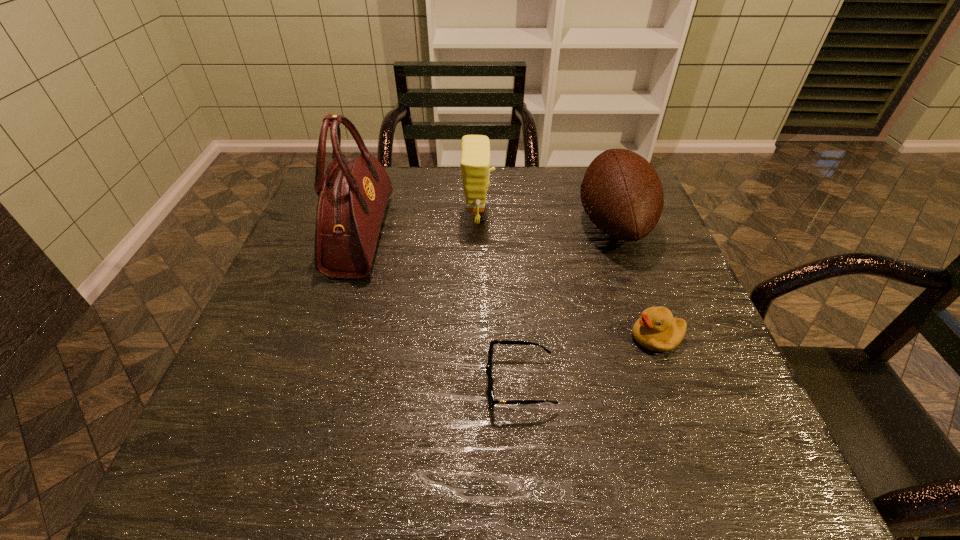
You are a GUI agent. You are given a task and a screenshot of the screen. Output one action in this format:
    pyautogui.click(x=<x>, y=<y>)
    Task: Click on the vacant region located 0.290m on the laces of the football
    The height and width of the screenshot is (540, 960).
    Given the screenshot: What is the action you would take?
    pyautogui.click(x=469, y=224)

What are the coordinates of `vacant space located at the beak of the fourth tallest object` in the screenshot? It's located at (582, 338).

Locate an element on the screen. This screenshot has height=540, width=960. free region located 0.390m at the beak of the fourth tallest object is located at coordinates (441, 338).

Identify the location of vacant region located at the beak of the fourth tallest object. The width and height of the screenshot is (960, 540). (494, 338).

This screenshot has width=960, height=540. Identify the location of vacant space located on the front-facing side of the sunglasses. (283, 383).

Where is `vacant space located on the front-facing side of the sunglasses`? This screenshot has height=540, width=960. vacant space located on the front-facing side of the sunglasses is located at coordinates (411, 383).

What are the coordinates of `free space located on the front-facing side of the sunglasses` in the screenshot? It's located at (373, 383).

In order to click on handbag at the far edge in this screenshot , I will do `click(353, 195)`.

The height and width of the screenshot is (540, 960). Find the location of `sponge positioned at the far edge`. sponge positioned at the far edge is located at coordinates (475, 149).

Where is `football that is at the far edge`? This screenshot has width=960, height=540. football that is at the far edge is located at coordinates (622, 194).